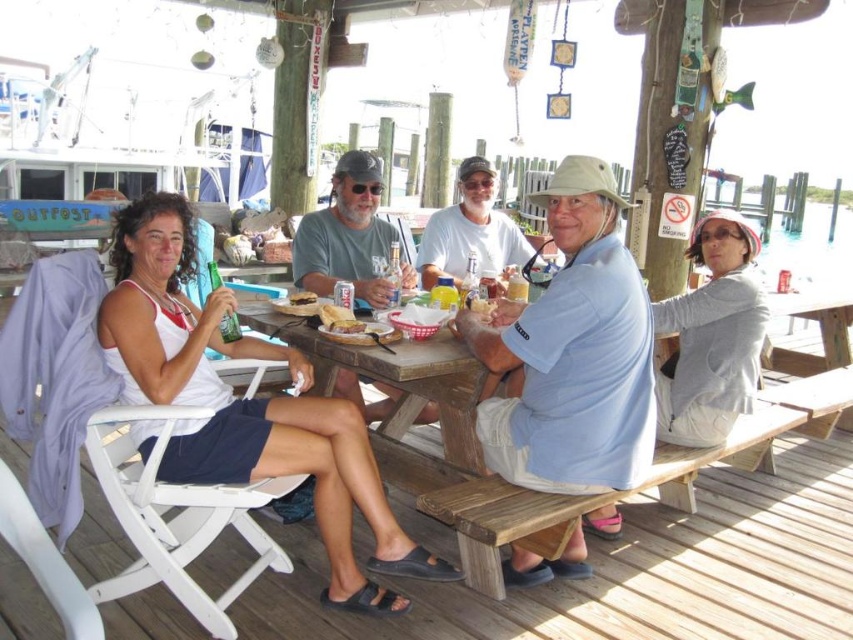
Who is shorter, wooden bench at lower center or gray fabric shirt at center?

wooden bench at lower center

Is wooden bench at lower center behind gray fabric shirt at center?

No, wooden bench at lower center is in front of gray fabric shirt at center.

What do you see at coordinates (631, 570) in the screenshot? I see `wooden bench at lower center` at bounding box center [631, 570].

In order to click on wooden bench at lower center in this screenshot , I will do `click(631, 570)`.

Is the position of gray fabric shirt at center more distant than that of brown bread at center?

Yes, gray fabric shirt at center is behind brown bread at center.

Does gray fabric shirt at center have a smaller size compared to brown bread at center?

No.

Locate an element on the screen. This screenshot has width=853, height=640. gray fabric shirt at center is located at coordinates point(346,234).

The image size is (853, 640). What are the coordinates of `gray fabric shirt at center` in the screenshot? It's located at (346, 234).

Can you confirm if wooden bench at lower center is positioned below slightly toasted bread at center?

Yes.

The height and width of the screenshot is (640, 853). What do you see at coordinates (631, 570) in the screenshot?
I see `wooden bench at lower center` at bounding box center [631, 570].

Locate an element on the screen. Image resolution: width=853 pixels, height=640 pixels. wooden bench at lower center is located at coordinates (631, 570).